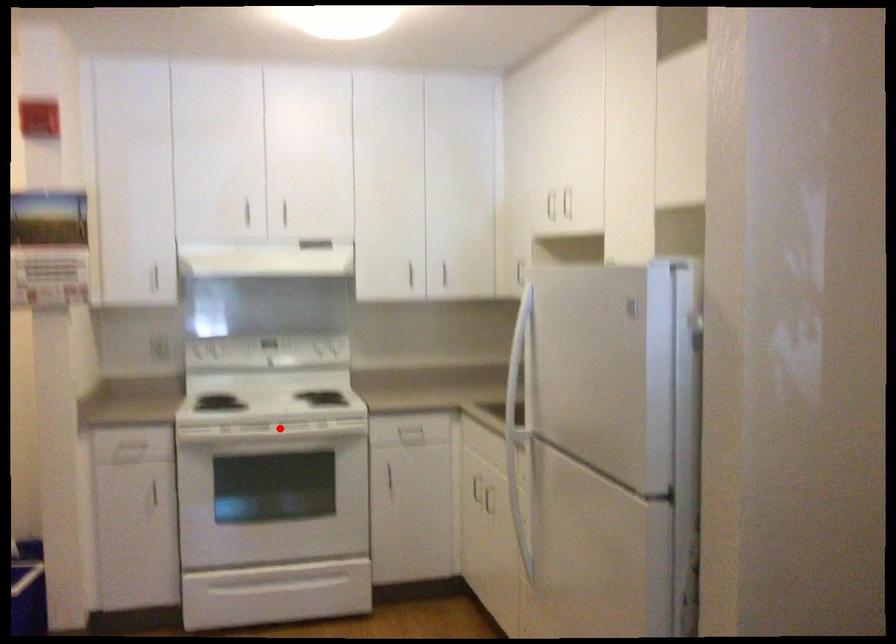
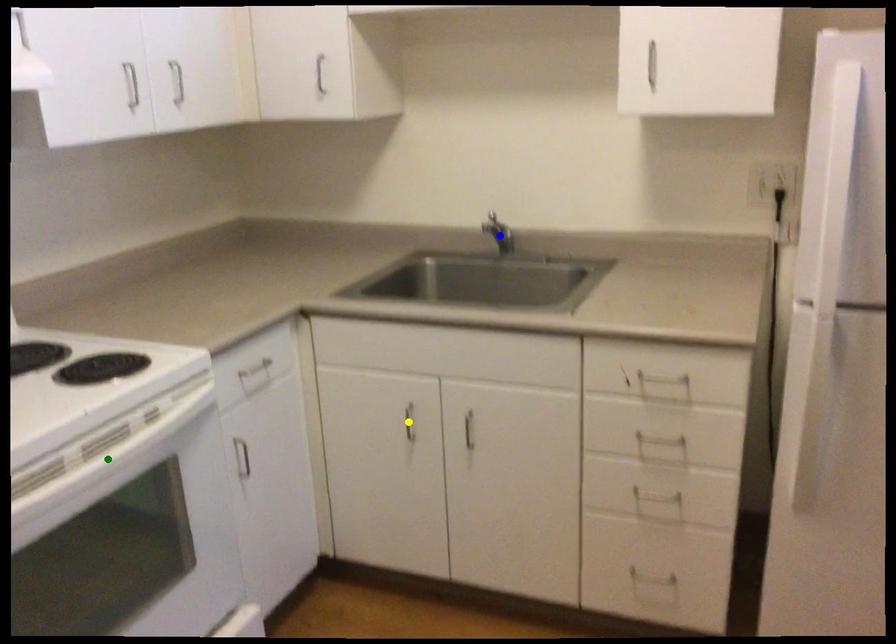
Question: I am providing you with two images of the same scene from different viewpoints. A red point is marked on the first image. You are given multiple points on the second image. Which spot in image 2 lines up with the point in image 1?

Choices:
 (A) blue point
 (B) green point
 (C) yellow point

Answer: (B)